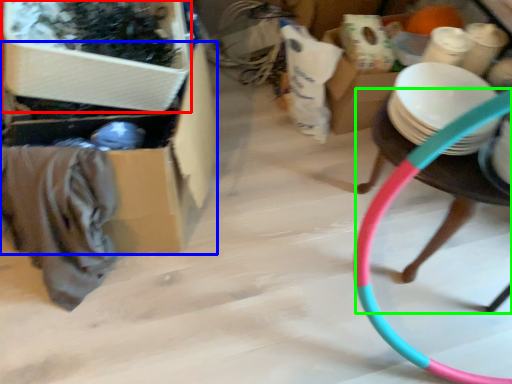
Question: Which object is the farthest from storage box (highlighted by a red box)? Choose among these: storage box (highlighted by a blue box) or chair (highlighted by a green box).

Choices:
 (A) storage box
 (B) chair

Answer: (B)